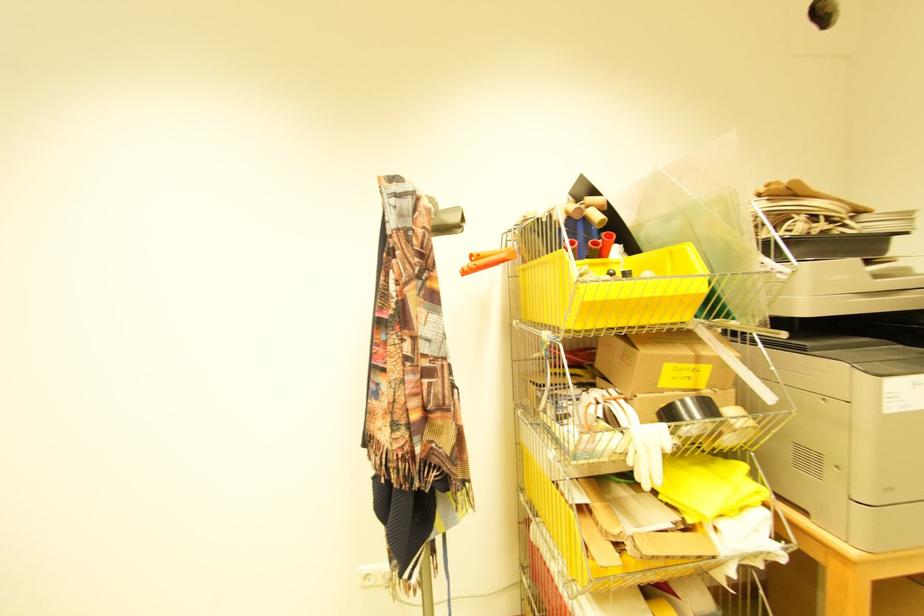
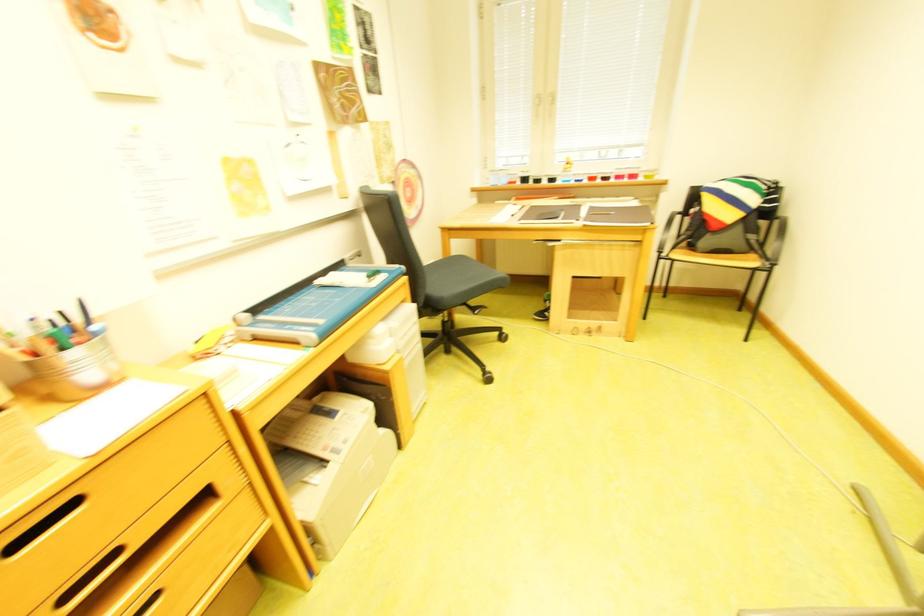
First-person continuous shooting, in which direction is the camera rotating?

The rotation direction of the camera is left-down.